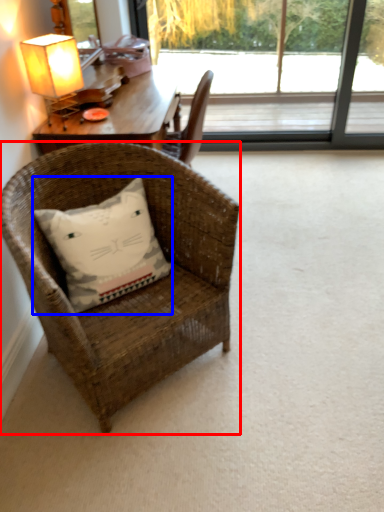
Question: Among these objects, which one is nearest to the camera, chair (highlighted by a red box) or pillow (highlighted by a blue box)?

Choices:
 (A) chair
 (B) pillow

Answer: (A)